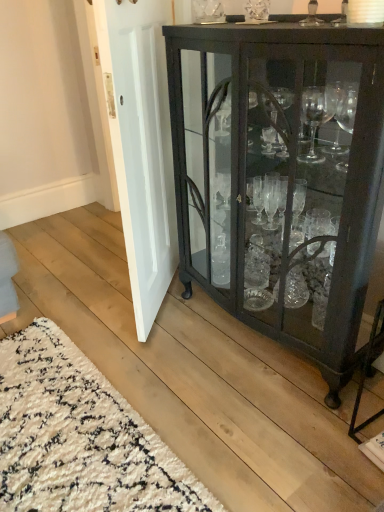
This screenshot has height=512, width=384. Find the location of `free location in front of white painted wood door at center`. free location in front of white painted wood door at center is located at coordinates (172, 365).